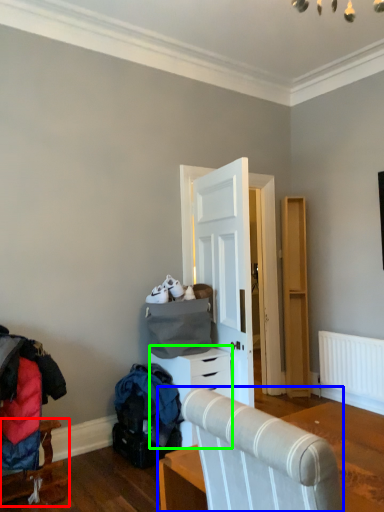
Question: Which is nearer to the furniture (highlighted by a red box)? furniture (highlighted by a blue box) or chest of drawers (highlighted by a green box).

Choices:
 (A) furniture
 (B) chest of drawers

Answer: (B)